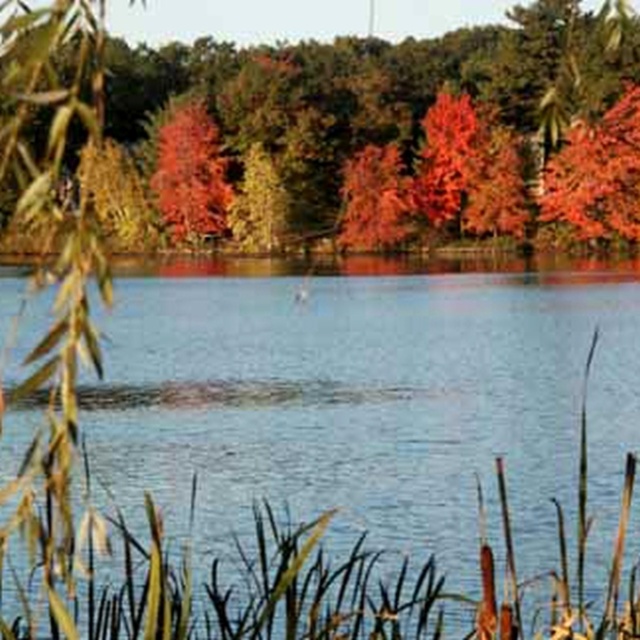
Between point (102, 458) and point (332, 131), which one is positioned in front?

Point (102, 458)

Can you confirm if clear water at center is smaller than autumn leaves at upper center?

Yes.

Is point (266, 449) less distant than point (589, 221)?

Yes.

In order to click on clear water at center in this screenshot , I will do 371,396.